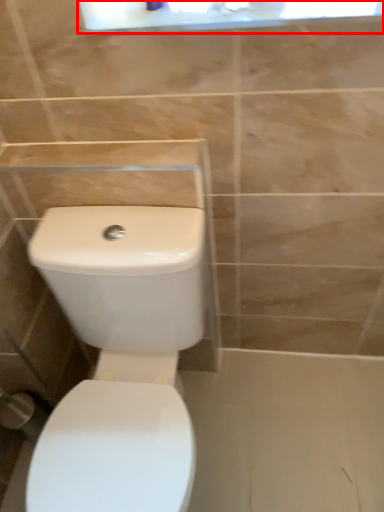
Question: From the image's perspective, what is the correct spatial positioning of medicine cabinet (annotated by the red box) in reference to toilet?

Choices:
 (A) above
 (B) below

Answer: (A)